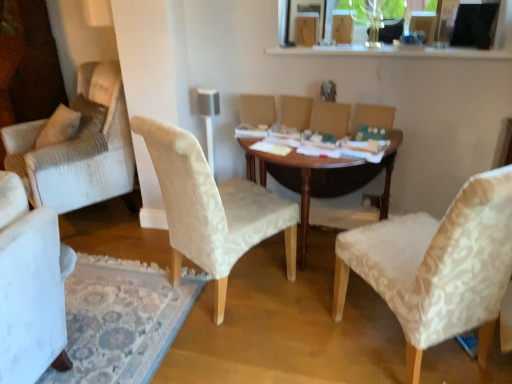
Question: Is wooden table at center wider or thinner than velvet beige armchair at center, which is the second armchair in right-to-left order?

Choices:
 (A) thin
 (B) wide

Answer: (B)

Question: In terms of height, does wooden table at center look taller or shorter compared to velvet beige armchair at center, positioned as the first armchair in left-to-right order?

Choices:
 (A) tall
 (B) short

Answer: (A)

Question: Which of these objects is positioned closest to the velvet beige armchair at center, which is the second armchair in right-to-left order?

Choices:
 (A) wooden table at center
 (B) beige fabric armchair at center, which is counted as the second armchair, starting from the left
 (C) white textured chair at center, which is counted as the first chair, starting from the left
 (D) white textured chair at right, acting as the second chair starting from the left

Answer: (B)

Question: Which of these objects is positioned closest to the white textured chair at right, acting as the second chair starting from the left?

Choices:
 (A) white textured chair at center, which is the 2th chair from right to left
 (B) wooden table at center
 (C) velvet beige armchair at center, positioned as the first armchair in left-to-right order
 (D) beige fabric armchair at center, which is counted as the second armchair, starting from the left

Answer: (B)